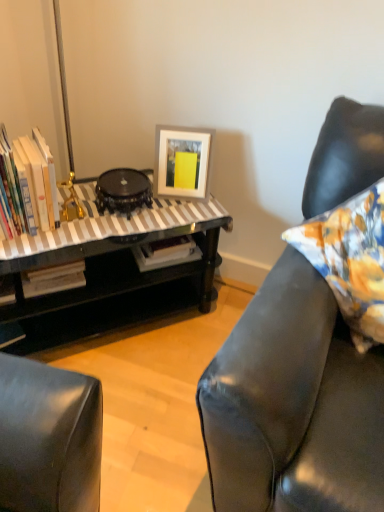
Find the location of a particular element. The image size is (384, 512). free location to the right of black glossy round table at center is located at coordinates (173, 211).